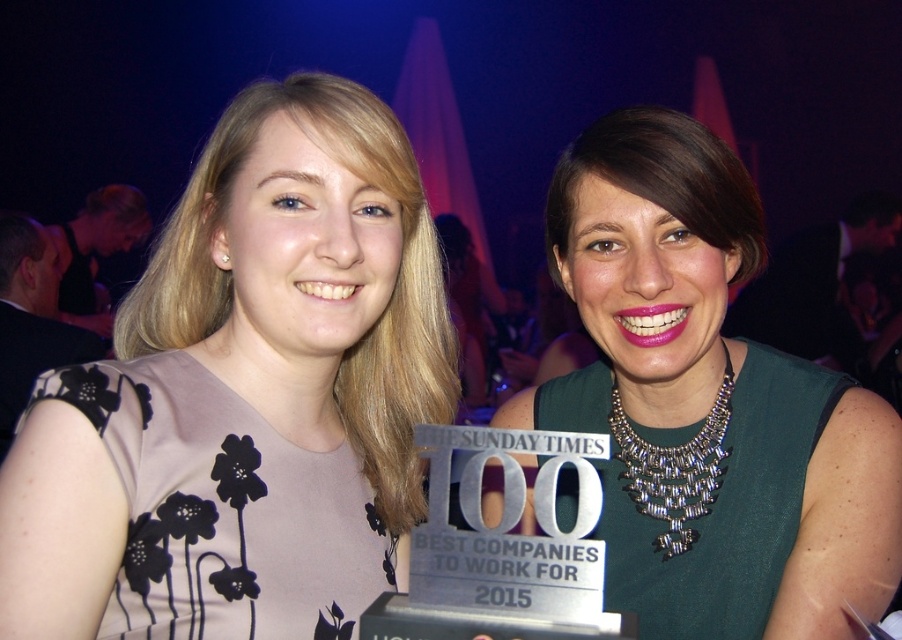
Can you confirm if green metallic necklace at center is positioned to the right of silver metallic necklace at upper center?

Incorrect, green metallic necklace at center is not on the right side of silver metallic necklace at upper center.

Does green metallic necklace at center have a lesser width compared to silver metallic necklace at upper center?

Incorrect, green metallic necklace at center's width is not less than silver metallic necklace at upper center's.

The width and height of the screenshot is (902, 640). I want to click on green metallic necklace at center, so click(x=707, y=403).

Is point (383, 426) less distant than point (663, 502)?

Yes, it is.

At what (x,y) coordinates should I click in order to perform the action: click on pink matte dress at center. Please return your answer as a coordinate pair (x, y). The width and height of the screenshot is (902, 640). Looking at the image, I should click on (244, 396).

Based on the photo, between pink matte dress at center and green metallic necklace at center, which one is positioned lower?

pink matte dress at center is lower down.

Which is behind, point (132, 324) or point (670, 268)?

Positioned behind is point (670, 268).

Is point (238, 481) positioned after point (709, 182)?

No, (238, 481) is closer to viewer.

Where is `pink matte dress at center`? pink matte dress at center is located at coordinates (244, 396).